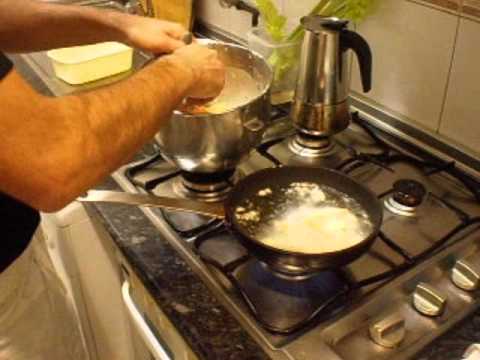
Where is `cabinet`? Image resolution: width=480 pixels, height=360 pixels. cabinet is located at coordinates (103, 316).